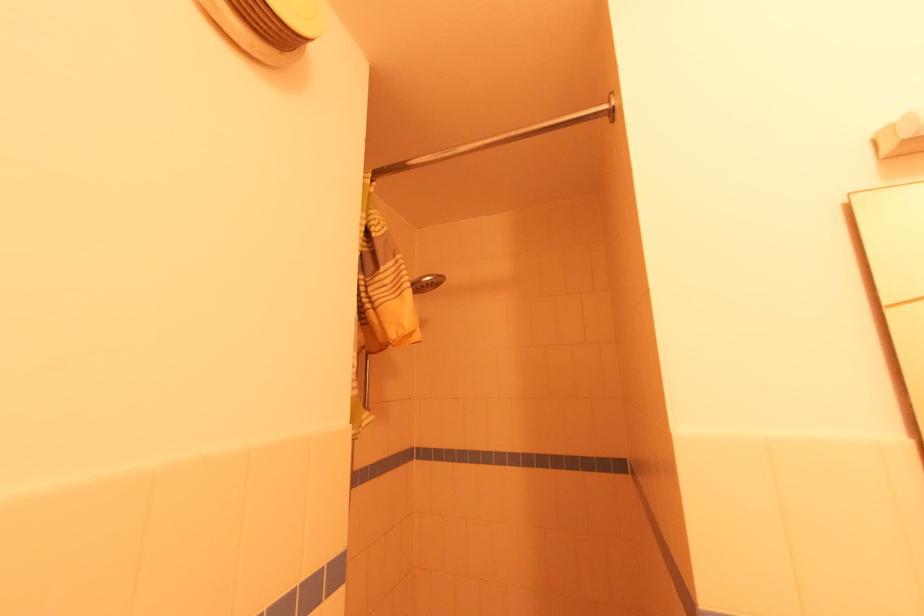
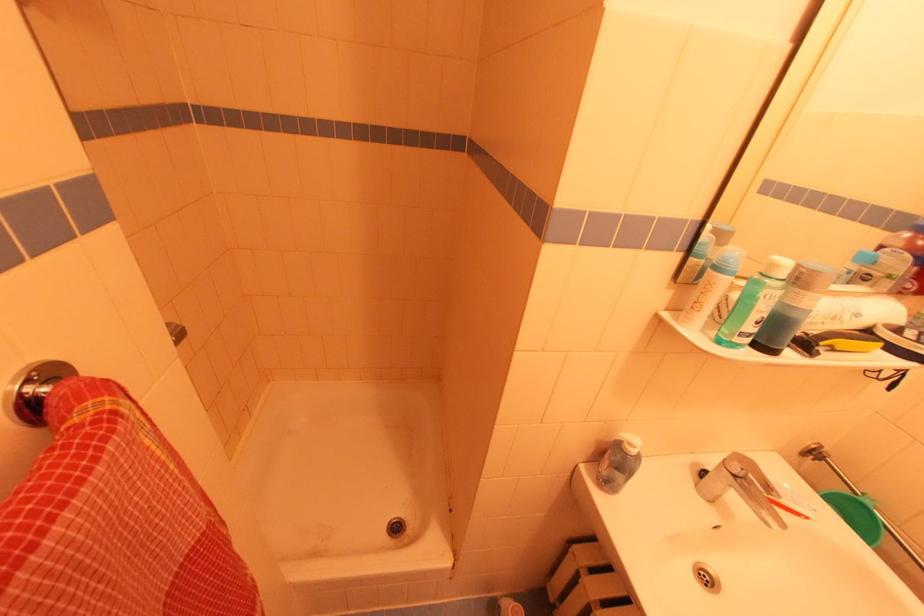
The images are taken continuously from a first-person perspective. In which direction is your viewpoint rotating?

The rotation direction of the camera is right-down.